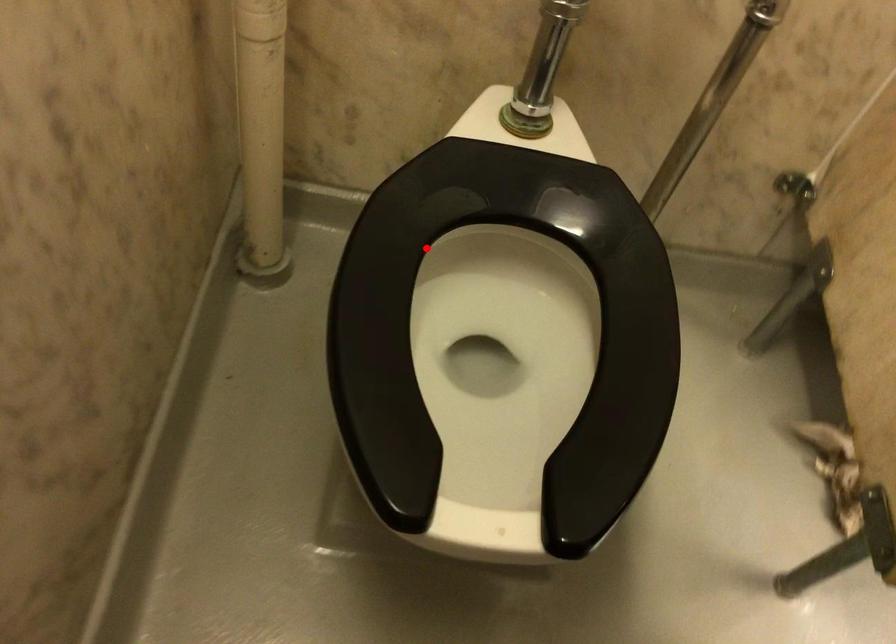
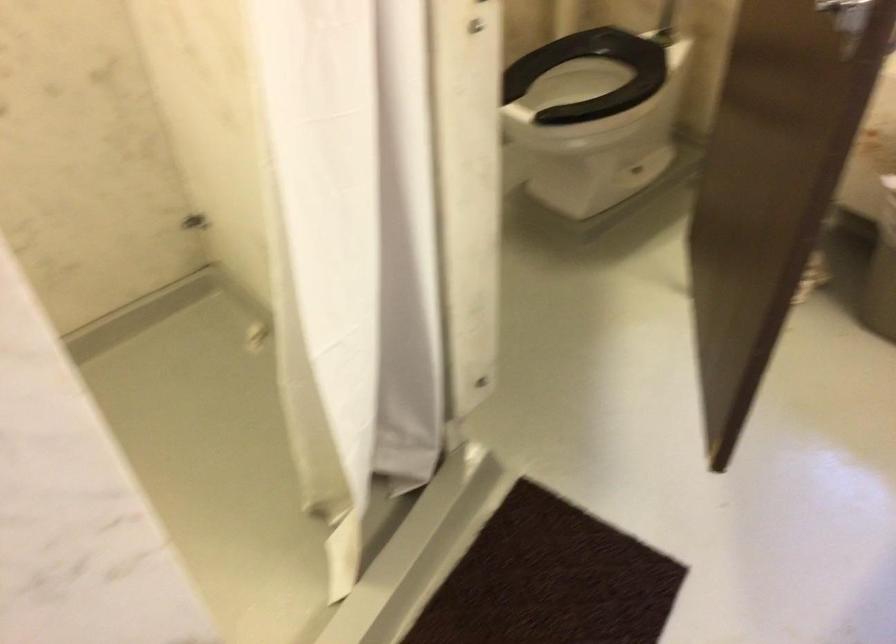
Locate, in the second image, the point that corresponds to the highlighted location in the first image.

(591, 75)